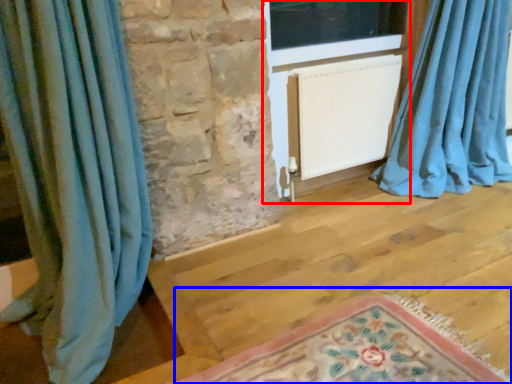
Question: Which point is closer to the camera, screen door (highlighted by a red box) or mat (highlighted by a blue box)?

Choices:
 (A) screen door
 (B) mat

Answer: (B)